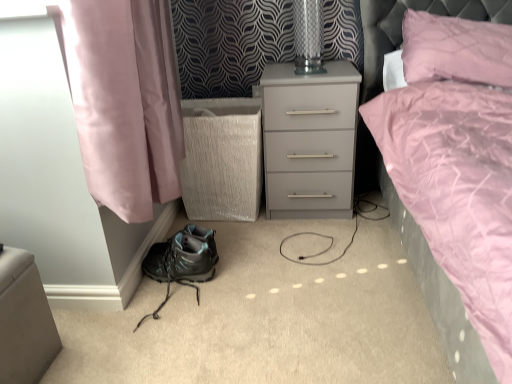
Identify the location of free location in front of matte black hiking boot at lower left. (155, 355).